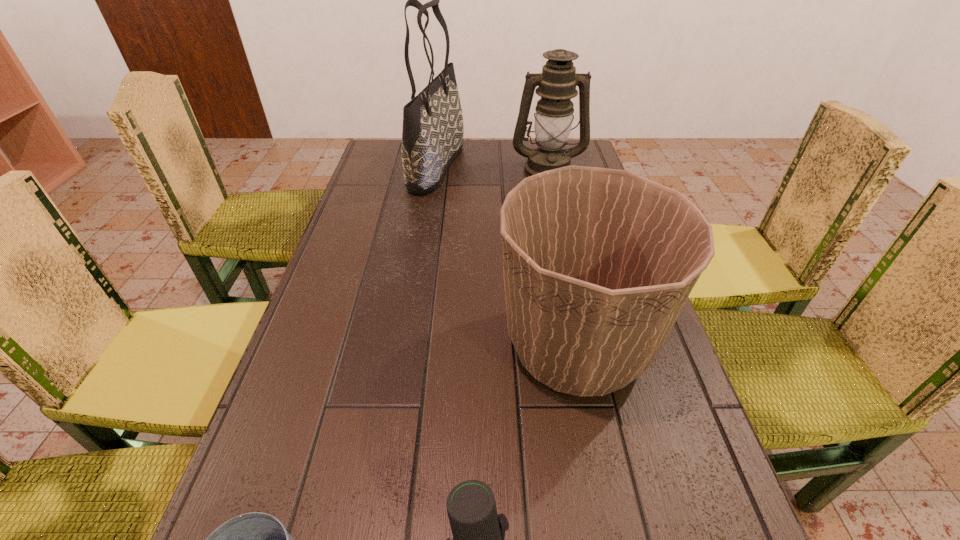
Where is `oil lamp that is at the right edge`? The image size is (960, 540). oil lamp that is at the right edge is located at coordinates (557, 83).

Where is `flowerpot that is at the right edge`? The width and height of the screenshot is (960, 540). flowerpot that is at the right edge is located at coordinates (598, 263).

Locate an element on the screen. The image size is (960, 540). object that is at the far left corner is located at coordinates (432, 136).

This screenshot has width=960, height=540. I want to click on object present at the far right corner, so click(x=557, y=83).

The width and height of the screenshot is (960, 540). I want to click on free space at the far edge of the desktop, so click(447, 171).

At what (x,y) coordinates should I click in order to perform the action: click on blank space at the left edge of the desktop. Please return your answer as a coordinate pair (x, y). Looking at the image, I should click on (396, 198).

In order to click on free space at the far left corner of the desktop in this screenshot , I will do `click(375, 171)`.

Where is `unoccupied position between the oil lamp and the tote bag`? The width and height of the screenshot is (960, 540). unoccupied position between the oil lamp and the tote bag is located at coordinates (492, 168).

Identify the location of vacant area that lies between the oil lamp and the tote bag. (492, 168).

Identify the location of free space between the tote bag and the oil lamp. This screenshot has height=540, width=960. (492, 168).